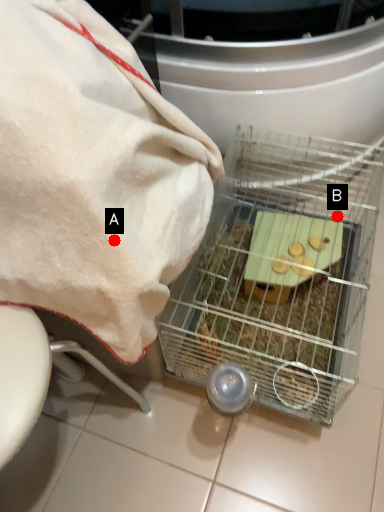
Question: Two points are circled on the image, labeled by A and B beside each circle. Which point is closer to the camera?

Choices:
 (A) A is closer
 (B) B is closer

Answer: (A)